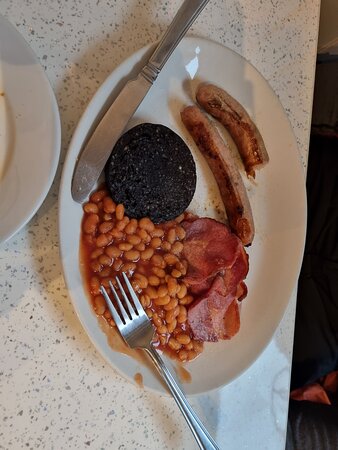
Identify the location of white countertop with grey specks. (88, 403).